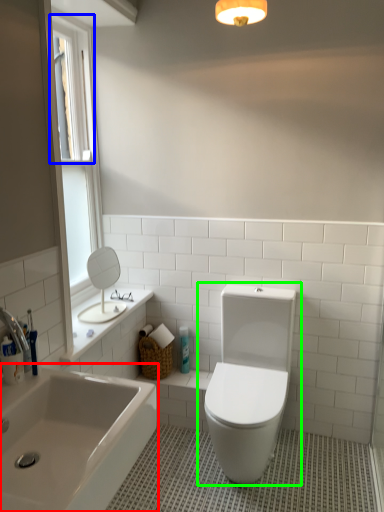
Question: Which object is the farthest from bathtub (highlighted by a red box)? Choose among these: window screen (highlighted by a blue box) or toilet (highlighted by a green box).

Choices:
 (A) window screen
 (B) toilet

Answer: (A)